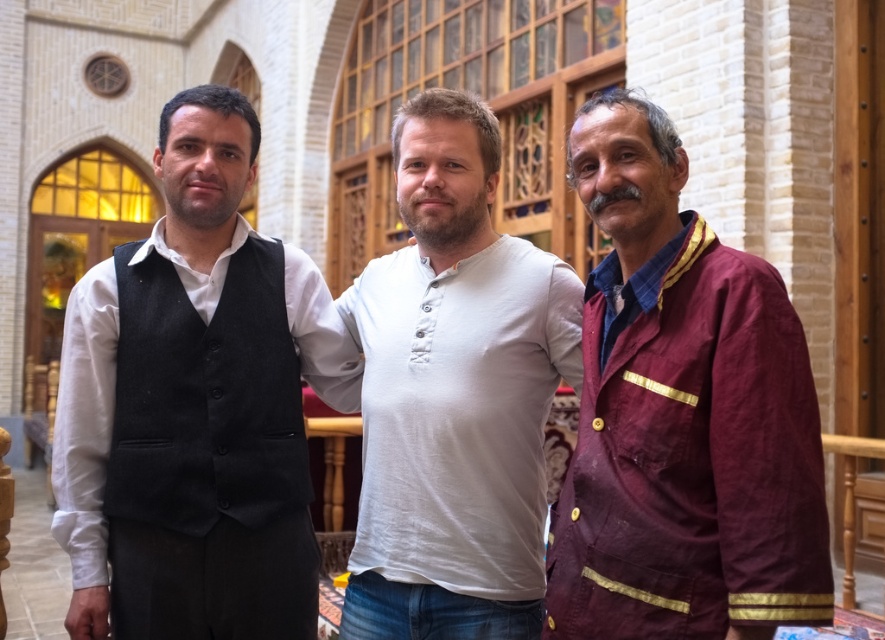
Question: Among these points, which one is farthest from the camera?

Choices:
 (A) (676, 289)
 (B) (139, 456)
 (C) (94, 529)
 (D) (383, 419)

Answer: (D)

Question: Does black wool vest at left appear on the right side of black woolen vest at left?

Choices:
 (A) no
 (B) yes

Answer: (B)

Question: Is maroon fabric jacket at right to the right of white cotton shirt at center from the viewer's perspective?

Choices:
 (A) yes
 (B) no

Answer: (A)

Question: Which is farther from the maroon fabric jacket at right?

Choices:
 (A) black woolen vest at left
 (B) white cotton shirt at center

Answer: (A)

Question: Which object is closer to the camera taking this photo?

Choices:
 (A) black woolen vest at left
 (B) black wool vest at left

Answer: (B)

Question: Does white cotton shirt at center appear on the right side of black woolen vest at left?

Choices:
 (A) no
 (B) yes

Answer: (B)